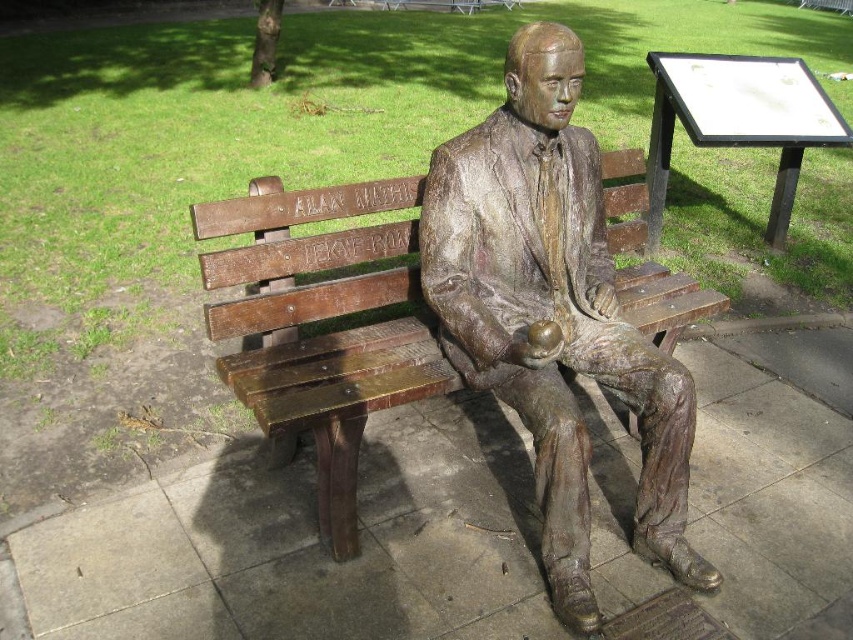
You are standing in a park and see the bronze statue at center. If you want to touch it without moving your feet, can you reach it?

The bronze statue at center is 6.85 feet away from viewer, so you cannot reach it without moving your feet since the distance is too far.

You are standing in a park and see the bronze statue at center and the bronze wood bench at center. Which object is nearer to you?

The bronze statue at center is closer to the viewer than the bronze wood bench at center.

You are standing in the park and want to take a photo of the statue. You notice two points on the wooden bench where you can place your tripod. The first point is at coordinates point (498,124) and the second is at point (218,372). Which point is closer to you, the viewer, so that your tripod will be positioned nearer to the statue?

Point (498,124) is closer to the viewer than point (218,372), so placing the tripod there will position it nearer to the statue.